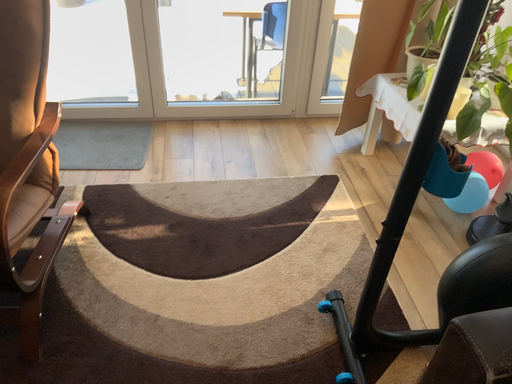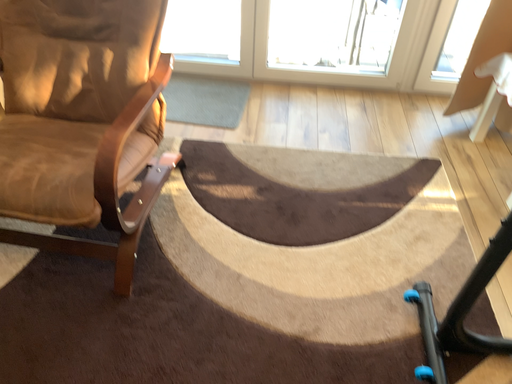
Question: How did the camera likely rotate when shooting the video?

Choices:
 (A) rotated left
 (B) rotated right

Answer: (A)